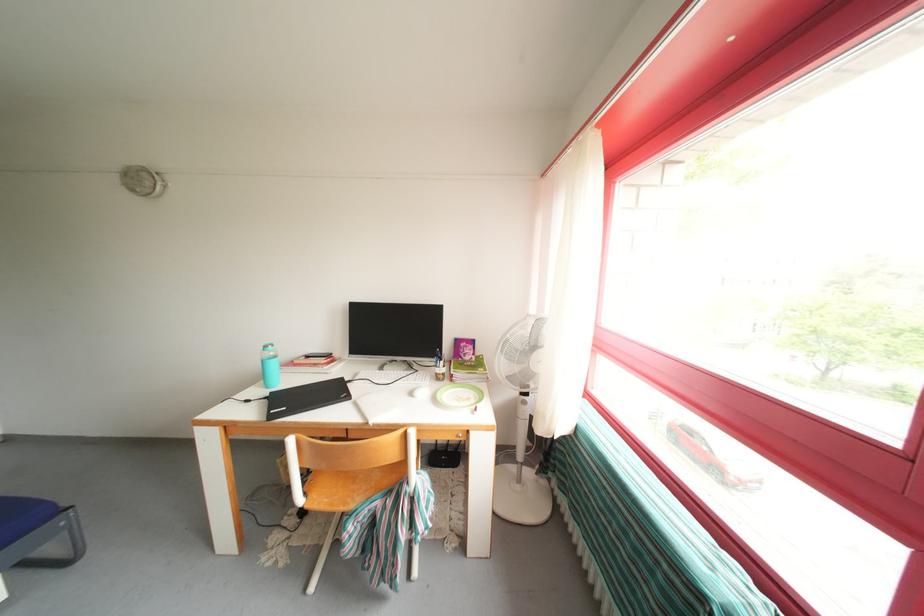
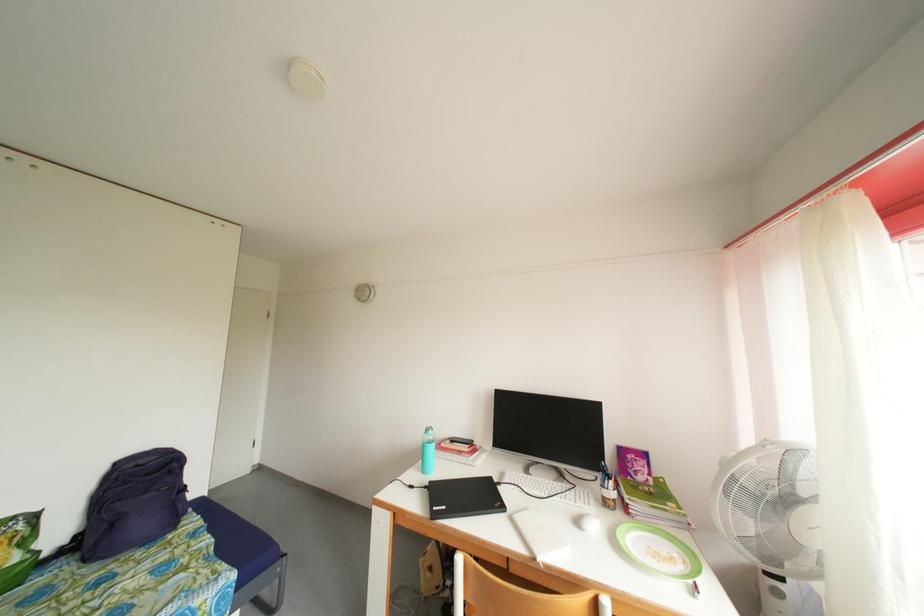
The point at [273,403] is marked in the first image. Where is the corresponding point in the second image?

(432, 493)